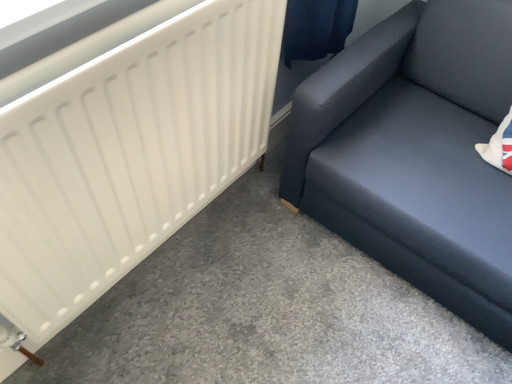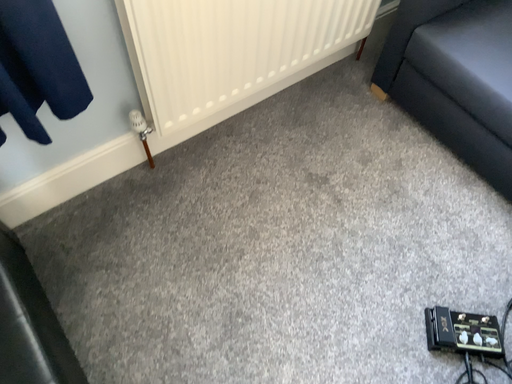
Question: How did the camera likely rotate when shooting the video?

Choices:
 (A) rotated left
 (B) rotated right

Answer: (A)